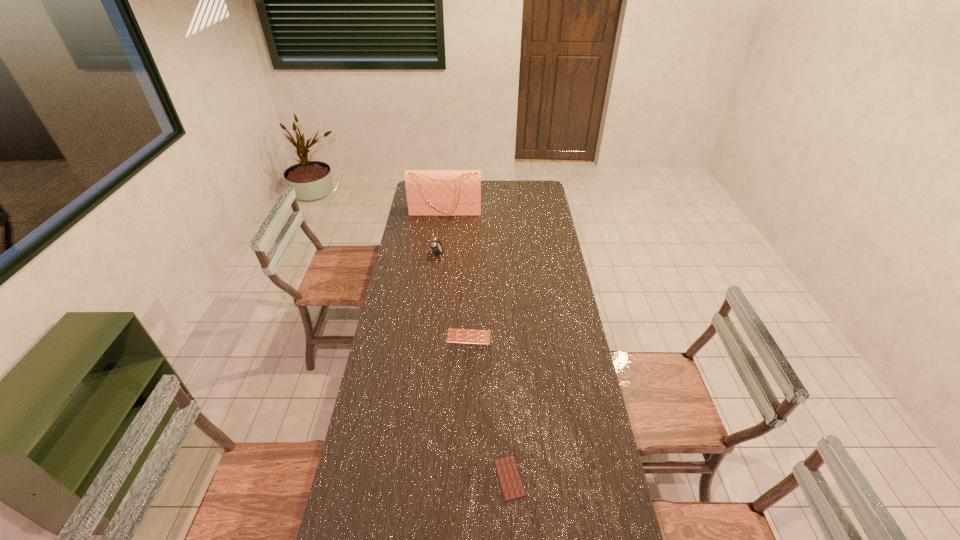
The width and height of the screenshot is (960, 540). I want to click on free location that satisfies the following two spatial constraints: 1. on the front-facing side of the tallest object; 2. on the left side of the shortest object, so click(417, 478).

Where is `free space that satisfies the following two spatial constraints: 1. on the front-facing side of the third tallest object; 2. on the left side of the handbag`? This screenshot has height=540, width=960. free space that satisfies the following two spatial constraints: 1. on the front-facing side of the third tallest object; 2. on the left side of the handbag is located at coordinates (432, 336).

The height and width of the screenshot is (540, 960). Identify the location of blank space that satisfies the following two spatial constraints: 1. on the front-facing side of the tallest object; 2. on the face of the third nearest object. (441, 254).

Find the location of a particular element. Image resolution: width=960 pixels, height=540 pixels. free spot that satisfies the following two spatial constraints: 1. on the front-facing side of the taller chocolate bar; 2. on the left side of the tallest object is located at coordinates (432, 336).

The width and height of the screenshot is (960, 540). Identify the location of vacant region that satisfies the following two spatial constraints: 1. on the face of the second tallest object; 2. on the back side of the second shortest object. (428, 336).

Locate an element on the screen. The width and height of the screenshot is (960, 540). vacant area in the image that satisfies the following two spatial constraints: 1. on the face of the second farthest object; 2. on the left side of the taller chocolate bar is located at coordinates (428, 336).

Find the location of a particular element. This screenshot has width=960, height=540. free space that satisfies the following two spatial constraints: 1. on the front-facing side of the second nearest object; 2. on the left side of the farthest object is located at coordinates (432, 336).

Find the location of a particular element. The width and height of the screenshot is (960, 540). free space that satisfies the following two spatial constraints: 1. on the face of the shortest object; 2. on the right side of the alarm clock is located at coordinates (412, 478).

This screenshot has height=540, width=960. I want to click on vacant space that satisfies the following two spatial constraints: 1. on the front side of the farther chocolate bar; 2. on the left side of the shortest object, so click(465, 478).

You are a GUI agent. You are given a task and a screenshot of the screen. Output one action in this format:
    pyautogui.click(x=<x>, y=<y>)
    Task: Click on the free region that satisfies the following two spatial constraints: 1. on the front-facing side of the farthest object; 2. on the right side of the nearest object
    
    Given the screenshot: What is the action you would take?
    pyautogui.click(x=417, y=478)